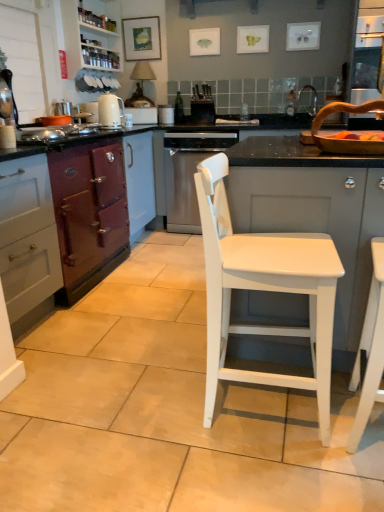
Question: Considering the relative positions of purple matte oven at left, which appears as the first cabinetry when viewed from the left, and white ceramic sink at upper right in the image provided, is purple matte oven at left, which appears as the first cabinetry when viewed from the left, to the left of white ceramic sink at upper right from the viewer's perspective?

Choices:
 (A) yes
 (B) no

Answer: (A)

Question: Does purple matte oven at left, marked as the fourth cabinetry in a right-to-left arrangement, have a lesser height compared to white ceramic sink at upper right?

Choices:
 (A) yes
 (B) no

Answer: (B)

Question: From a real-world perspective, is purple matte oven at left, which appears as the first cabinetry when viewed from the left, on white ceramic sink at upper right?

Choices:
 (A) yes
 (B) no

Answer: (B)

Question: From the image's perspective, is purple matte oven at left, which appears as the first cabinetry when viewed from the left, below white ceramic sink at upper right?

Choices:
 (A) yes
 (B) no

Answer: (A)

Question: Does purple matte oven at left, which appears as the first cabinetry when viewed from the left, have a greater height compared to white ceramic sink at upper right?

Choices:
 (A) no
 (B) yes

Answer: (B)

Question: Is matte wooden picture frame at upper center wider or thinner than white matte cabinet at center, the 1th cabinetry viewed from the right?

Choices:
 (A) thin
 (B) wide

Answer: (A)

Question: Is point (122, 23) closer or farther from the camera than point (357, 227)?

Choices:
 (A) farther
 (B) closer

Answer: (A)

Question: Considering their positions, is matte wooden picture frame at upper center located in front of or behind white matte cabinet at center, the 1th cabinetry viewed from the right?

Choices:
 (A) behind
 (B) front

Answer: (A)

Question: Would you say matte wooden picture frame at upper center is inside or outside white matte cabinet at center, the 1th cabinetry viewed from the right?

Choices:
 (A) inside
 (B) outside

Answer: (B)

Question: Considering the positions of point (365, 328) and point (160, 33), is point (365, 328) closer or farther from the camera than point (160, 33)?

Choices:
 (A) closer
 (B) farther

Answer: (A)

Question: In the image, is white matte chair at right, arranged as the 2th chair when viewed from the left, positioned in front of or behind matte wooden picture frame at upper center?

Choices:
 (A) behind
 (B) front

Answer: (B)

Question: From a real-world perspective, is white matte chair at right, arranged as the 2th chair when viewed from the left, physically located above or below matte wooden picture frame at upper center?

Choices:
 (A) below
 (B) above

Answer: (A)

Question: From the image's perspective, is white matte chair at right, the first chair in the right-to-left sequence, positioned above or below matte wooden picture frame at upper center?

Choices:
 (A) above
 (B) below

Answer: (B)

Question: Considering their positions, is white wood cabinet at upper left, the third cabinetry when ordered from left to right, located in front of or behind black matte oven at center, which is the first appliance in right-to-left order?

Choices:
 (A) front
 (B) behind

Answer: (A)

Question: Is white wood cabinet at upper left, placed as the 2th cabinetry when sorted from right to left, bigger or smaller than black matte oven at center, which is counted as the third appliance, starting from the left?

Choices:
 (A) big
 (B) small

Answer: (A)